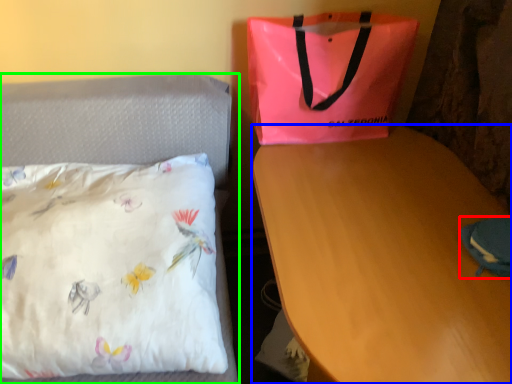
Question: Which object is the closest to the pouch (highlighted by a red box)? Choose among these: desk (highlighted by a blue box) or bed (highlighted by a green box).

Choices:
 (A) desk
 (B) bed

Answer: (A)